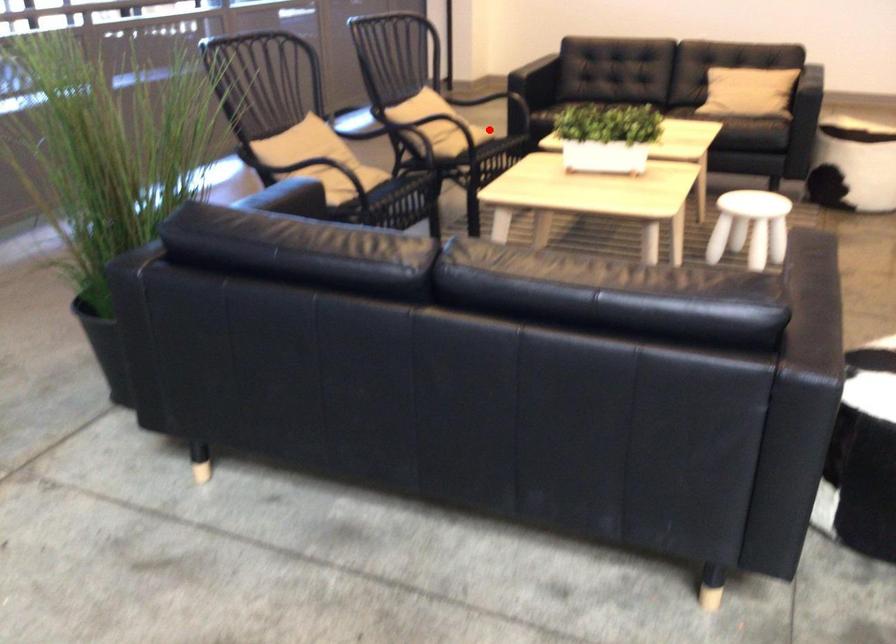
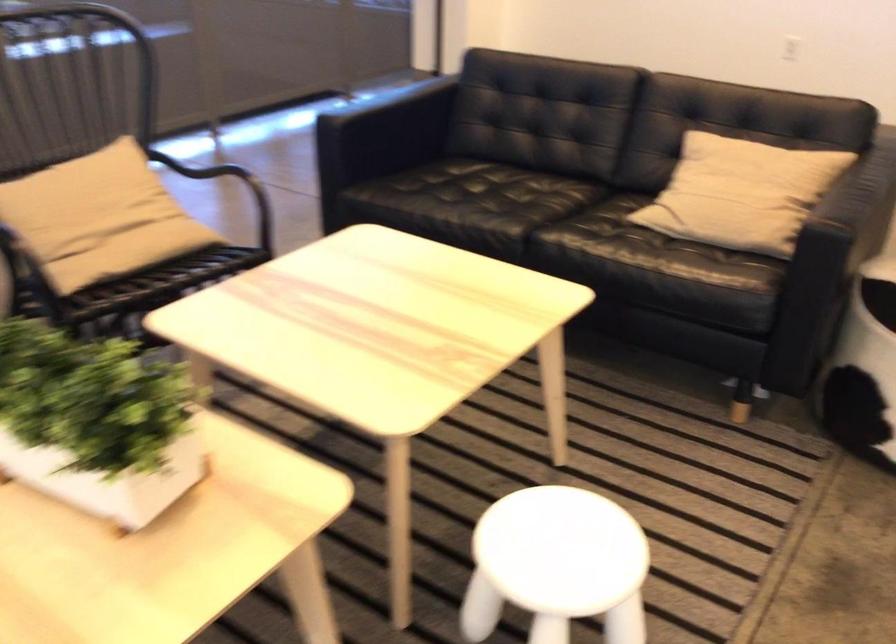
Question: I am providing you with two images of the same scene from different viewpoints. In image1, a red point is highlighted. Considering the same 3D point in image2, which of the following is correct?

Choices:
 (A) It is closer
 (B) It is farther

Answer: (A)